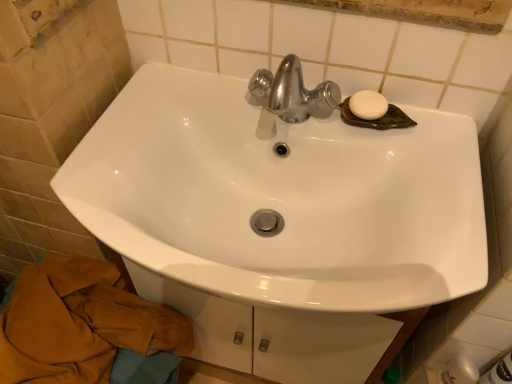
Question: Does brown cotton bath towel at lower left have a greater width compared to white glossy sink at center?

Choices:
 (A) no
 (B) yes

Answer: (A)

Question: From a real-world perspective, is brown cotton bath towel at lower left positioned over white glossy sink at center based on gravity?

Choices:
 (A) yes
 (B) no

Answer: (B)

Question: Are brown cotton bath towel at lower left and white glossy sink at center far apart?

Choices:
 (A) yes
 (B) no

Answer: (B)

Question: Is brown cotton bath towel at lower left positioned in front of white glossy sink at center?

Choices:
 (A) yes
 (B) no

Answer: (B)

Question: Can you confirm if brown cotton bath towel at lower left is taller than white glossy sink at center?

Choices:
 (A) yes
 (B) no

Answer: (A)

Question: From a real-world perspective, relative to white matte soap at upper right, is brown cotton bath towel at lower left vertically above or below?

Choices:
 (A) below
 (B) above

Answer: (A)

Question: Considering the positions of brown cotton bath towel at lower left and white matte soap at upper right in the image, is brown cotton bath towel at lower left wider or thinner than white matte soap at upper right?

Choices:
 (A) wide
 (B) thin

Answer: (A)

Question: Based on their sizes in the image, would you say brown cotton bath towel at lower left is bigger or smaller than white matte soap at upper right?

Choices:
 (A) big
 (B) small

Answer: (A)

Question: Would you say brown cotton bath towel at lower left is to the left or to the right of white matte soap at upper right in the picture?

Choices:
 (A) right
 (B) left

Answer: (B)

Question: Does point (142, 79) appear closer or farther from the camera than point (376, 107)?

Choices:
 (A) closer
 (B) farther

Answer: (B)

Question: In the image, is white glossy sink at center on the left side or the right side of white matte soap at upper right?

Choices:
 (A) right
 (B) left

Answer: (B)

Question: From a real-world perspective, is white glossy sink at center above or below white matte soap at upper right?

Choices:
 (A) below
 (B) above

Answer: (A)

Question: Looking at their shapes, would you say white glossy sink at center is wider or thinner than white matte soap at upper right?

Choices:
 (A) thin
 (B) wide

Answer: (B)

Question: Considering the positions of point (365, 94) and point (58, 365), is point (365, 94) closer or farther from the camera than point (58, 365)?

Choices:
 (A) farther
 (B) closer

Answer: (A)

Question: Visually, is white matte soap at upper right positioned to the left or to the right of brown cotton bath towel at lower left?

Choices:
 (A) right
 (B) left

Answer: (A)